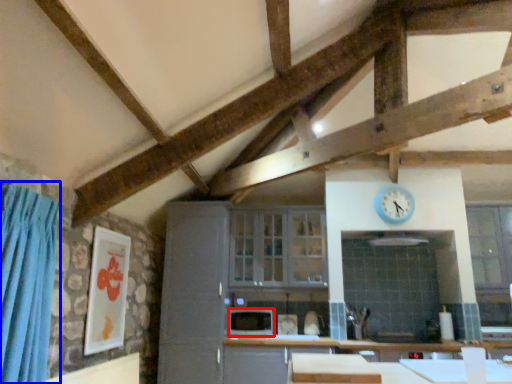
Question: Which object appears closest to the camera in this image, appliance (highlighted by a red box) or curtain (highlighted by a blue box)?

Choices:
 (A) appliance
 (B) curtain

Answer: (B)